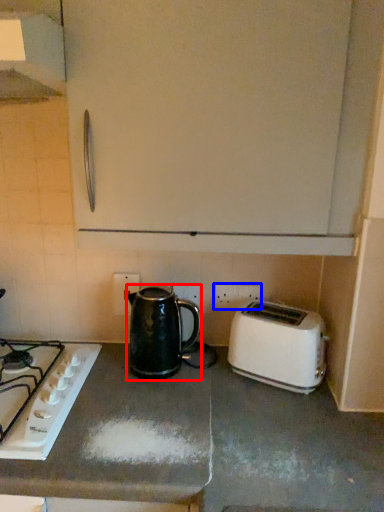
Question: Which object is further to the camera taking this photo, kettle (highlighted by a red box) or electric outlet (highlighted by a blue box)?

Choices:
 (A) kettle
 (B) electric outlet

Answer: (B)